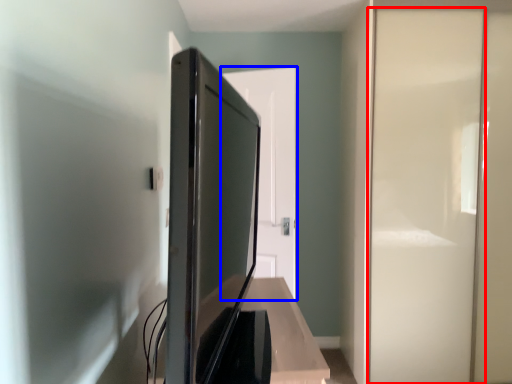
Question: Which point is closer to the camera, screen door (highlighted by a red box) or door (highlighted by a blue box)?

Choices:
 (A) screen door
 (B) door

Answer: (A)